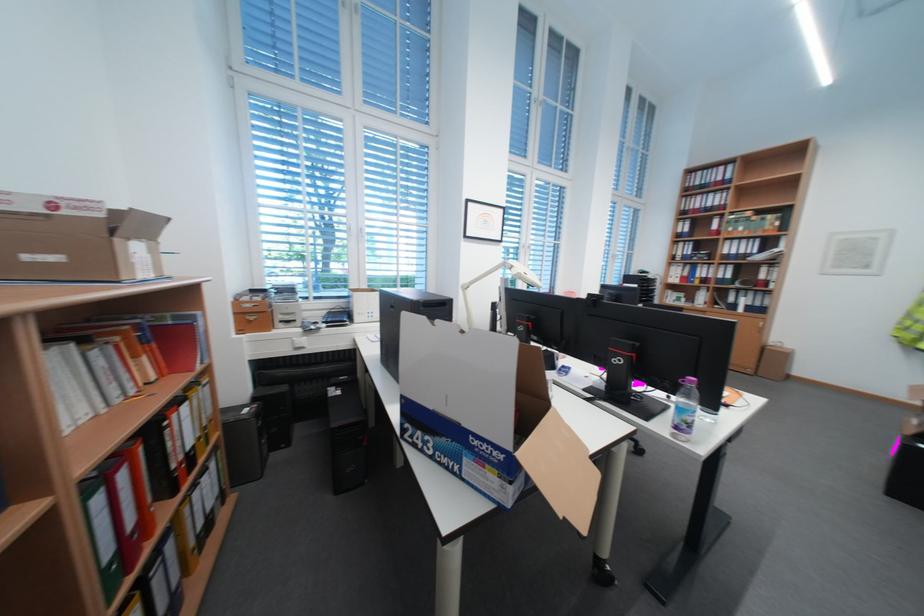
The image size is (924, 616). In order to click on black computer tower in this screenshot , I will do `click(346, 435)`.